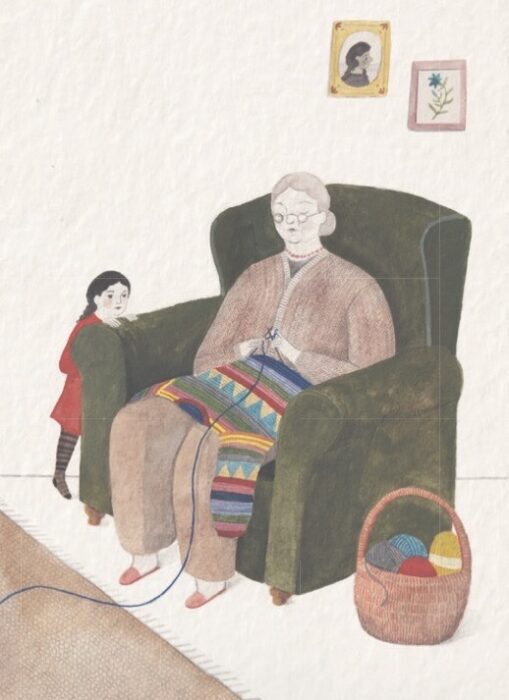
Where is `chair`? Image resolution: width=509 pixels, height=700 pixels. chair is located at coordinates (307, 484).